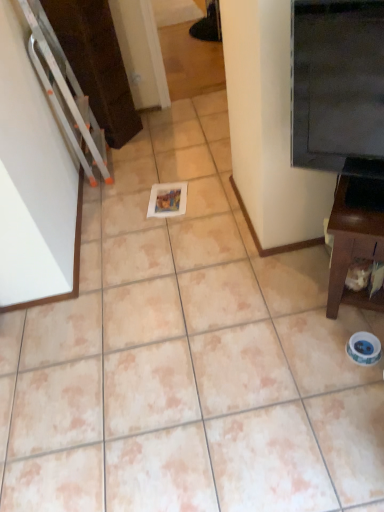
Question: From the image's perspective, is black glossy fridge at upper right located beneath brown wood tv stand at right?

Choices:
 (A) no
 (B) yes

Answer: (A)

Question: Does black glossy fridge at upper right have a larger size compared to brown wood tv stand at right?

Choices:
 (A) no
 (B) yes

Answer: (A)

Question: Does black glossy fridge at upper right have a greater height compared to brown wood tv stand at right?

Choices:
 (A) yes
 (B) no

Answer: (A)

Question: Is black glossy fridge at upper right next to brown wood tv stand at right?

Choices:
 (A) yes
 (B) no

Answer: (B)

Question: Is black glossy fridge at upper right shorter than brown wood tv stand at right?

Choices:
 (A) no
 (B) yes

Answer: (A)

Question: Does black glossy fridge at upper right appear on the left side of brown wood tv stand at right?

Choices:
 (A) no
 (B) yes

Answer: (B)

Question: Is black glossy fridge at upper right completely or partially inside brown wood tv stand at right?

Choices:
 (A) yes
 (B) no

Answer: (B)

Question: Is brown wood tv stand at right thinner than black glossy fridge at upper right?

Choices:
 (A) no
 (B) yes

Answer: (A)

Question: Is brown wood tv stand at right shorter than black glossy fridge at upper right?

Choices:
 (A) yes
 (B) no

Answer: (A)

Question: Is brown wood tv stand at right positioned with its back to black glossy fridge at upper right?

Choices:
 (A) no
 (B) yes

Answer: (A)

Question: Does brown wood tv stand at right have a greater height compared to black glossy fridge at upper right?

Choices:
 (A) yes
 (B) no

Answer: (B)

Question: Considering the relative sizes of brown wood tv stand at right and black glossy fridge at upper right in the image provided, is brown wood tv stand at right smaller than black glossy fridge at upper right?

Choices:
 (A) no
 (B) yes

Answer: (A)

Question: Considering their positions, is brown wood tv stand at right located in front of or behind black glossy fridge at upper right?

Choices:
 (A) front
 (B) behind

Answer: (B)